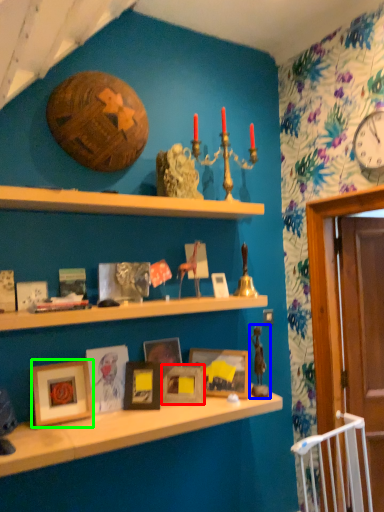
Question: Which is farther away from picture frame (highlighted by a red box)? toy (highlighted by a blue box) or picture frame (highlighted by a green box)?

Choices:
 (A) toy
 (B) picture frame

Answer: (B)